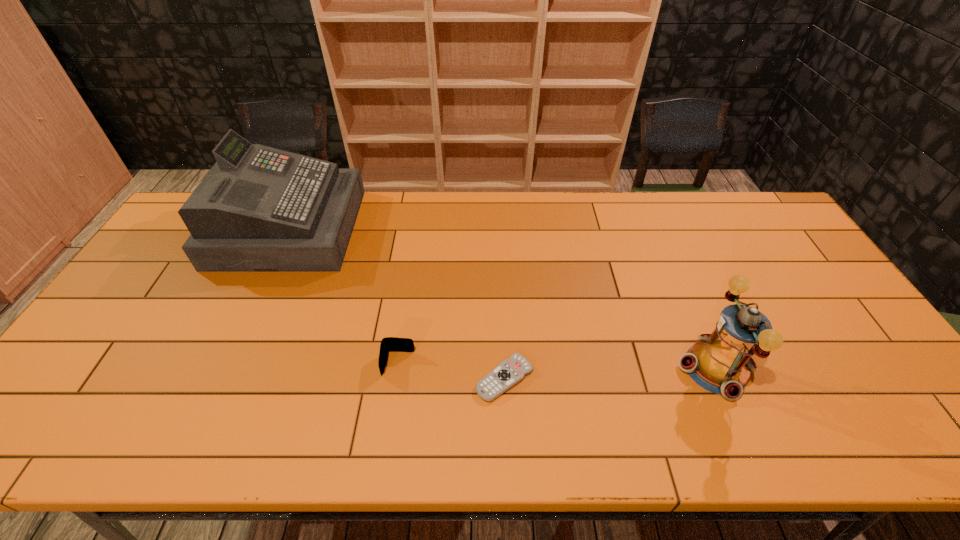
At what (x,y) coordinates should I click in order to perform the action: click on vacant space that is in between the leftmost object and the rightmost object. Please return your answer as a coordinate pair (x, y). The height and width of the screenshot is (540, 960). Looking at the image, I should click on (502, 298).

Locate which object ranks in proximity to the third tallest object. Please provide its 2D coordinates. Your answer should be formatted as a tuple, i.e. [(x, y)], where the tuple contains the x and y coordinates of a point satisfying the conditions above.

[(508, 373)]

Locate which object ranks third in proximity to the remote control. Please provide its 2D coordinates. Your answer should be formatted as a tuple, i.e. [(x, y)], where the tuple contains the x and y coordinates of a point satisfying the conditions above.

[(259, 209)]

At what (x,y) coordinates should I click in order to perform the action: click on vacant region that satisfies the following two spatial constraints: 1. on the outer surface of the wallet; 2. on the right side of the shortest object. Please return your answer as a coordinate pair (x, y). The height and width of the screenshot is (540, 960). Looking at the image, I should click on (396, 378).

At what (x,y) coordinates should I click in order to perform the action: click on vacant space that satisfies the following two spatial constraints: 1. on the front-facing side of the remote control; 2. on the left side of the cash register. Please return your answer as a coordinate pair (x, y). Looking at the image, I should click on (219, 378).

Identify the location of blank space that satisfies the following two spatial constraints: 1. on the front-facing side of the farthest object; 2. on the left side of the second object from right to left. (219, 378).

Identify the location of free region that satisfies the following two spatial constraints: 1. on the front-facing side of the third object from left to right; 2. on the right side of the leftmost object. (219, 378).

The image size is (960, 540). What are the coordinates of `vacant space that satisfies the following two spatial constraints: 1. on the front-facing side of the cash register; 2. on the right side of the shortest object` in the screenshot? It's located at (219, 378).

This screenshot has width=960, height=540. What are the coordinates of `free spot that satisfies the following two spatial constraints: 1. on the back side of the third object from left to right; 2. on the front-facing side of the farthest object` in the screenshot? It's located at (498, 228).

Identify the location of free space that satisfies the following two spatial constraints: 1. on the front-facing side of the farthest object; 2. on the right side of the second object from right to left. (219, 378).